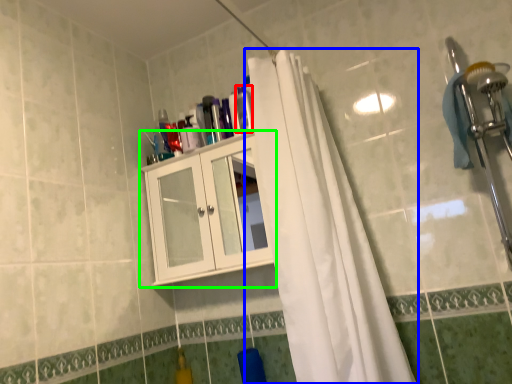
Question: Estimate the real-world distances between objects in this image. Which object is closer to toiletry (highlighted by a red box), curtain (highlighted by a blue box) or cabinetry (highlighted by a green box)?

Choices:
 (A) curtain
 (B) cabinetry

Answer: (B)